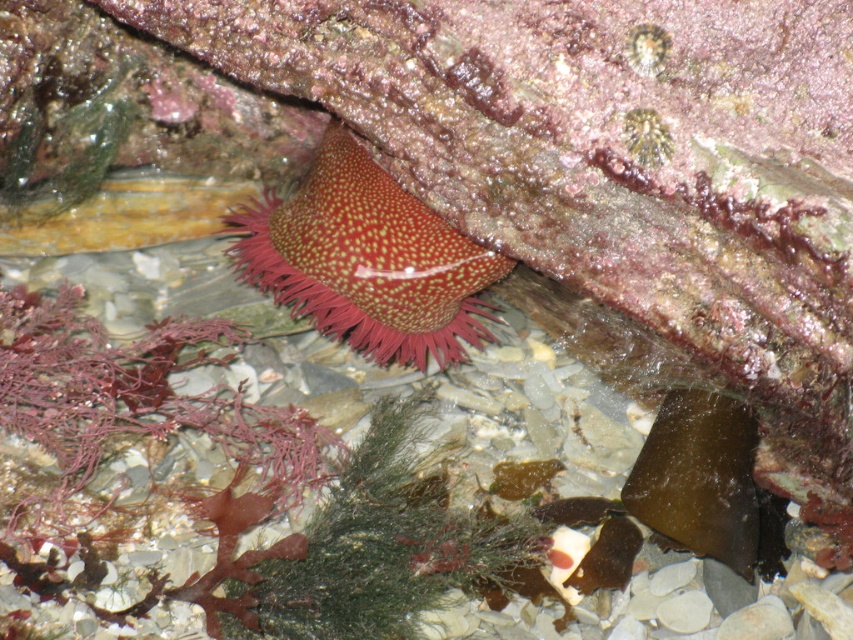
Is shiny red anemone at center closer to camera compared to green matte algae at center?

No, it is not.

Between shiny red anemone at center and green matte algae at center, which one is positioned higher?

shiny red anemone at center is higher up.

Who is more distant from viewer, (432,284) or (277,621)?

The point (432,284) is behind.

Identify the location of shiny red anemone at center. This screenshot has width=853, height=640. (366, 259).